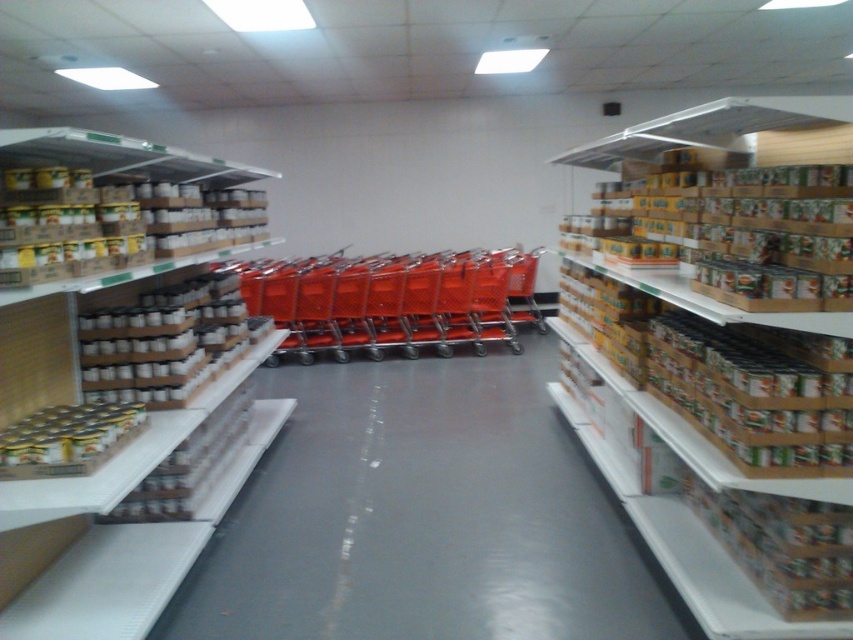
In the scene shown: You are a customer in the store and want to place a large item into the metallic orange shopping cart at center. However, you notice the brown cardboard boxes at right nearby. Based on their height, will the item fit into the cart without needing to remove the boxes?

The brown cardboard boxes at right are taller than the metallic orange shopping cart at center, so the item might not fit properly if the boxes are in the way. You may need to move the boxes to make space.

You are a customer in the store and want to pick up an item from the white cardboard boxes at left. However, there is a metallic orange shopping cart at center blocking your path. Can you reach the boxes without moving the cart?

The white cardboard boxes at left is below metallic orange shopping cart at center, so the cart is blocking the path. You need to move the metallic orange shopping cart at center to access the boxes.

You are a customer in the store and want to pick up an item from the brown cardboard boxes at right. However, there is a metallic orange shopping cart at center blocking your path. Can you easily reach the boxes without moving the cart?

The brown cardboard boxes at right is located below the metallic orange shopping cart at center, so you can easily reach the boxes without moving the cart since they are positioned lower and not obstructed by the cart.